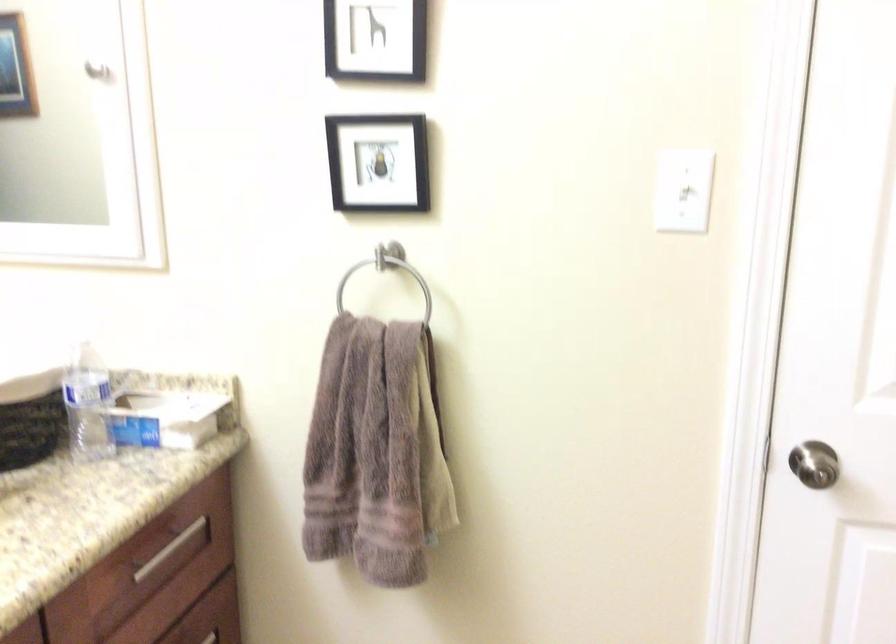
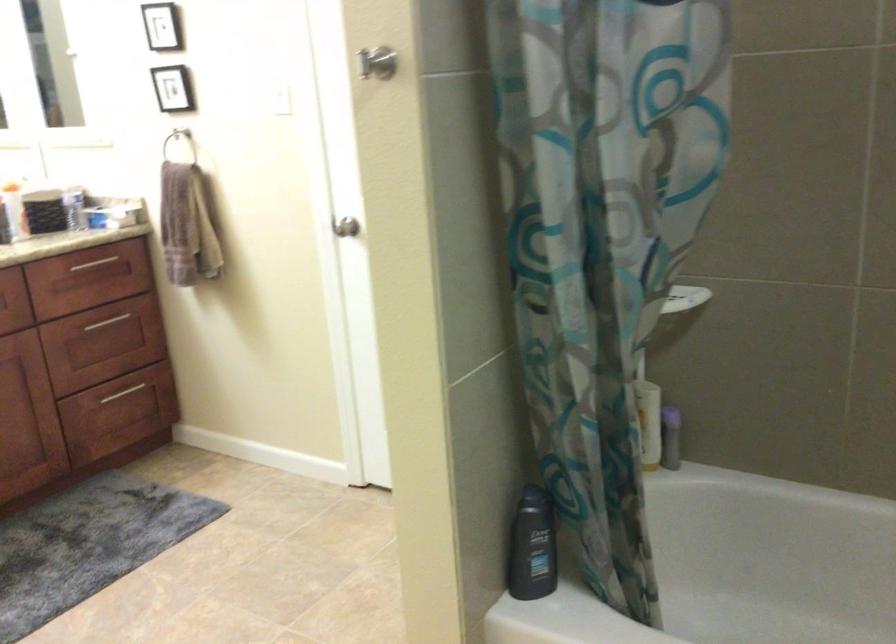
Which direction would the cameraman need to move to produce the second image?

The cameraman moved toward right, backward.